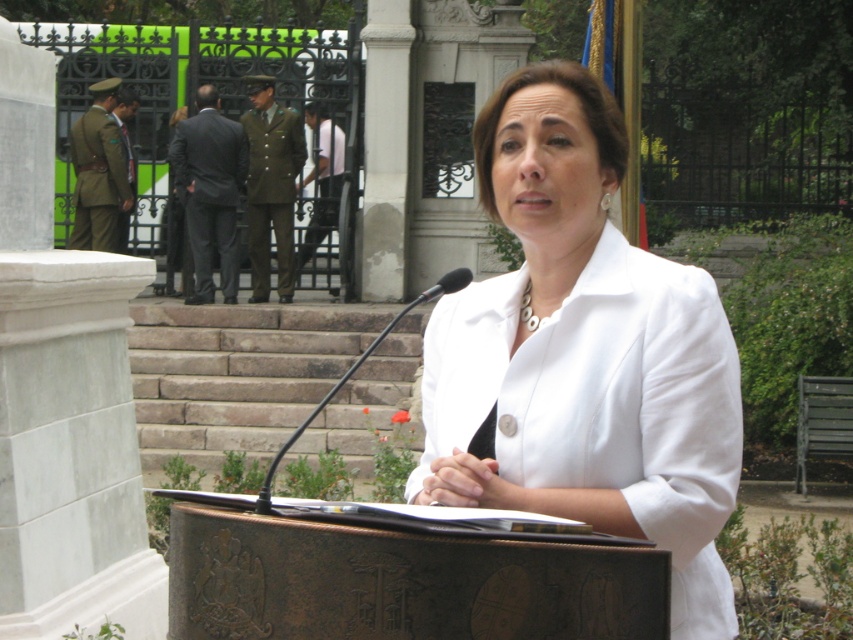
Does point (193, 177) come in front of point (96, 204)?

Yes.

Is dark gray suit at center positioned before green fabric uniform at left?

Yes, it is.

Does point (236, 148) come behind point (84, 122)?

No.

This screenshot has width=853, height=640. What are the coordinates of `dark gray suit at center` in the screenshot? It's located at (209, 193).

Who is higher up, green fabric uniform at center or green fabric uniform at left?

Positioned higher is green fabric uniform at left.

Where is `green fabric uniform at center`? Image resolution: width=853 pixels, height=640 pixels. green fabric uniform at center is located at coordinates (271, 193).

Is point (254, 122) less distant than point (122, 211)?

Yes, it is in front of point (122, 211).

At what (x,y) coordinates should I click in order to perform the action: click on green fabric uniform at center. Please return your answer as a coordinate pair (x, y). The image size is (853, 640). Looking at the image, I should click on (271, 193).

Does point (630, 436) lie behind point (210, 268)?

No.

Who is more forward, (474, 323) or (210, 150)?

Point (474, 323) is in front.

This screenshot has height=640, width=853. In order to click on white matte jacket at center in this screenshot , I will do `click(583, 355)`.